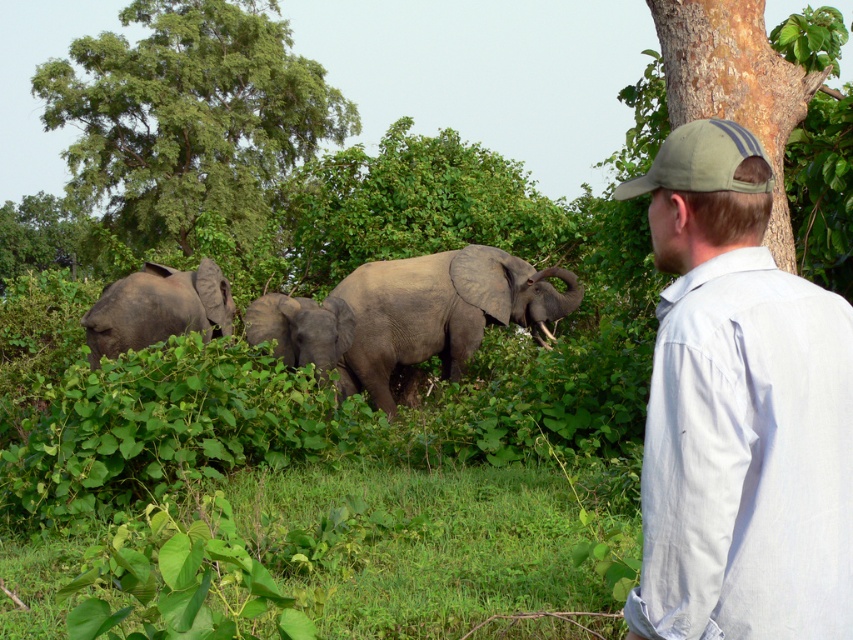
Can you confirm if gray matte elephant at center is positioned above gray matte baby elephant at center?

Correct, gray matte elephant at center is located above gray matte baby elephant at center.

Does gray matte elephant at center appear under gray matte baby elephant at center?

Actually, gray matte elephant at center is above gray matte baby elephant at center.

What are the coordinates of `gray matte elephant at center` in the screenshot? It's located at (440, 310).

Where is `gray matte elephant at center`? The width and height of the screenshot is (853, 640). gray matte elephant at center is located at coordinates (440, 310).

Who is more forward, (175, 236) or (432, 340)?

Positioned in front is point (432, 340).

Is point (144, 182) positioned before point (524, 312)?

No, (144, 182) is further to viewer.

Between point (74, 166) and point (498, 253), which one is positioned behind?

Positioned behind is point (74, 166).

Locate an element on the screen. The width and height of the screenshot is (853, 640). green leafy tree at upper left is located at coordinates (189, 116).

Measure the distance between point (x=223, y=305) and camera.

12.50 meters

Can you confirm if gray matte elephant at left is bigger than gray matte baby elephant at center?

Yes, gray matte elephant at left is bigger than gray matte baby elephant at center.

Between point (195, 288) and point (332, 344), which one is positioned in front?

Point (332, 344) is in front.

Locate an element on the screen. The width and height of the screenshot is (853, 640). gray matte elephant at left is located at coordinates click(x=157, y=308).